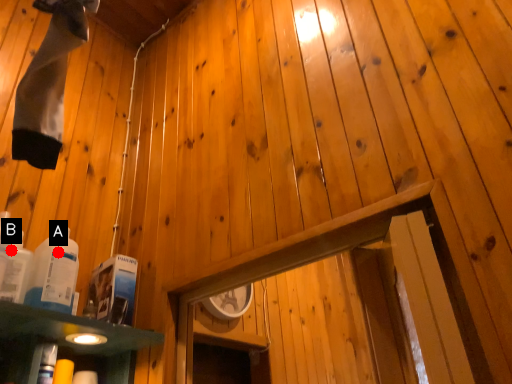
Question: Two points are circled on the image, labeled by A and B beside each circle. Which of the following is the farthest from the observer?

Choices:
 (A) A is further
 (B) B is further

Answer: (B)